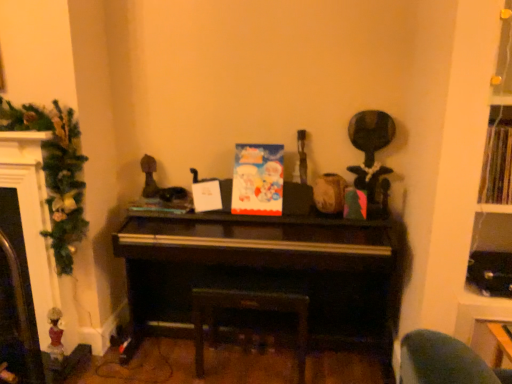
Question: Can dark wood piano at center be found inside matte black fireplace at left?

Choices:
 (A) no
 (B) yes

Answer: (A)

Question: Considering the relative positions of matte black fireplace at left and dark wood piano at center in the image provided, is matte black fireplace at left to the left of dark wood piano at center from the viewer's perspective?

Choices:
 (A) yes
 (B) no

Answer: (A)

Question: Can you confirm if matte black fireplace at left is positioned to the right of dark wood piano at center?

Choices:
 (A) yes
 (B) no

Answer: (B)

Question: Does matte black fireplace at left lie behind dark wood piano at center?

Choices:
 (A) yes
 (B) no

Answer: (A)

Question: Is matte black fireplace at left touching dark wood piano at center?

Choices:
 (A) no
 (B) yes

Answer: (A)

Question: Is the depth of matte black fireplace at left less than that of dark wood piano at center?

Choices:
 (A) yes
 (B) no

Answer: (B)

Question: Is matte plastic book at center, marked as the 1th book in a back-to-front arrangement, far away from matte paper card at center?

Choices:
 (A) no
 (B) yes

Answer: (A)

Question: From the image's perspective, is matte plastic book at center, placed as the 1th book when sorted from left to right, on top of matte paper card at center?

Choices:
 (A) no
 (B) yes

Answer: (A)

Question: Does matte plastic book at center, which is the 2th book from right to left, have a lesser width compared to matte paper card at center?

Choices:
 (A) yes
 (B) no

Answer: (B)

Question: Considering the relative sizes of matte plastic book at center, placed as the 1th book when sorted from left to right, and matte paper card at center in the image provided, is matte plastic book at center, placed as the 1th book when sorted from left to right, taller than matte paper card at center?

Choices:
 (A) no
 (B) yes

Answer: (A)

Question: Is matte plastic book at center, which is counted as the 2th book, starting from the front, shorter than matte paper card at center?

Choices:
 (A) yes
 (B) no

Answer: (A)

Question: Is matte plastic book at center, marked as the 1th book in a back-to-front arrangement, oriented towards matte paper card at center?

Choices:
 (A) yes
 (B) no

Answer: (B)

Question: Can you confirm if dark wood stool at center is wider than matte plastic book at center, which is counted as the 2th book, starting from the front?

Choices:
 (A) yes
 (B) no

Answer: (A)